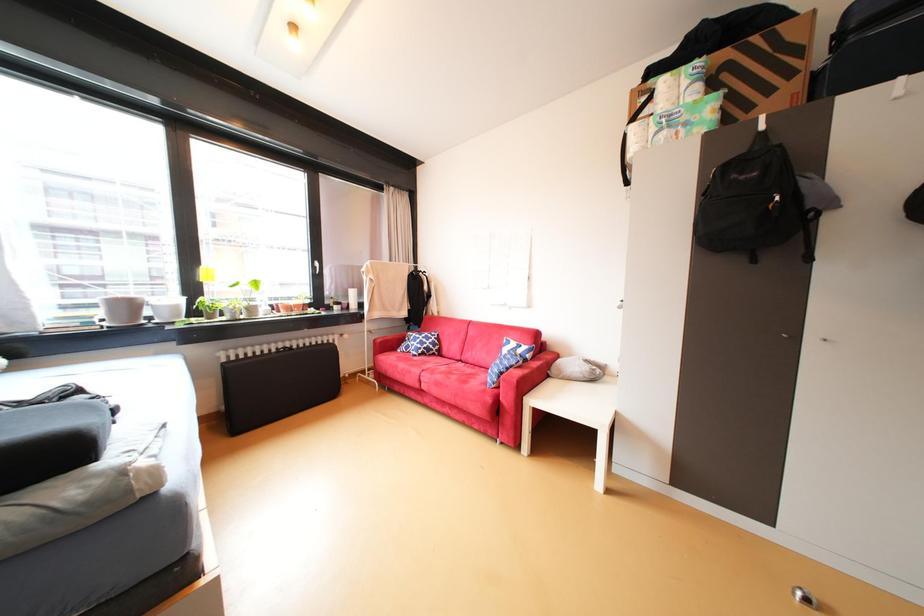
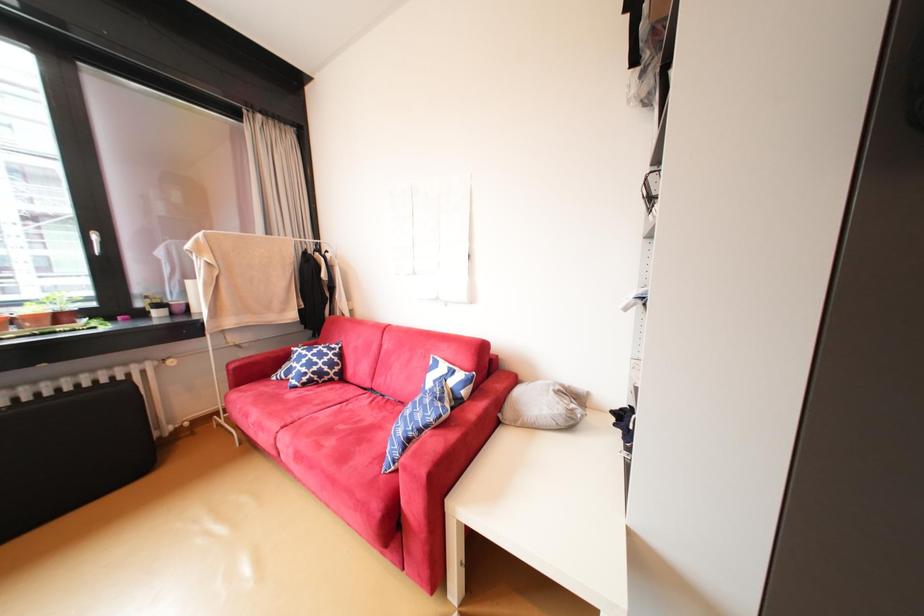
Which direction would the cameraman need to move to produce the second image?

The cameraman walked toward right, forward.